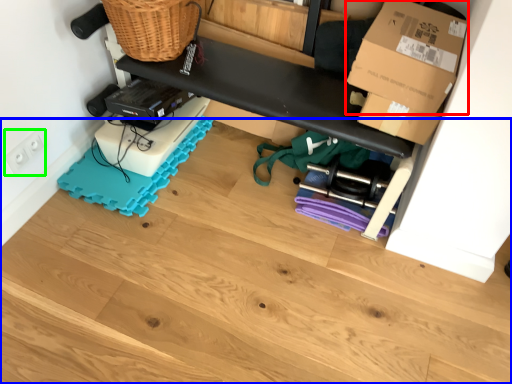
Question: Which object is positioned farthest from box (highlighted by a red box)? Select from wood (highlighted by a blue box) and electric outlet (highlighted by a green box).

Choices:
 (A) wood
 (B) electric outlet

Answer: (B)